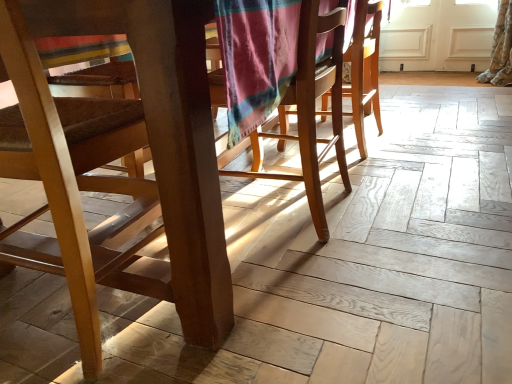
Question: Could you tell me if wooden chair at left, marked as the 1th chair in a left-to-right arrangement, is facing wooden chair at center, the 2th chair in the left-to-right sequence?

Choices:
 (A) no
 (B) yes

Answer: (A)

Question: Is the depth of wooden chair at left, which is the 2th chair in right-to-left order, greater than that of wooden chair at center, the 2th chair in the left-to-right sequence?

Choices:
 (A) yes
 (B) no

Answer: (B)

Question: Does wooden chair at left, which is the 2th chair in right-to-left order, appear on the right side of wooden chair at center, the 2th chair in the left-to-right sequence?

Choices:
 (A) yes
 (B) no

Answer: (B)

Question: From the image's perspective, is wooden chair at left, marked as the 1th chair in a left-to-right arrangement, below wooden chair at center, the 2th chair in the left-to-right sequence?

Choices:
 (A) no
 (B) yes

Answer: (B)

Question: Can you confirm if wooden chair at left, marked as the 1th chair in a left-to-right arrangement, is thinner than wooden chair at center, the 2th chair in the left-to-right sequence?

Choices:
 (A) no
 (B) yes

Answer: (A)

Question: Can you confirm if wooden chair at left, marked as the 1th chair in a left-to-right arrangement, is shorter than wooden chair at center, the 2th chair in the left-to-right sequence?

Choices:
 (A) no
 (B) yes

Answer: (A)

Question: From the image's perspective, does wooden chair at center, which is the 1th chair from right to left, appear higher than wooden chair at left, marked as the 1th chair in a left-to-right arrangement?

Choices:
 (A) yes
 (B) no

Answer: (A)

Question: Can you confirm if wooden chair at center, which is the 1th chair from right to left, is smaller than wooden chair at left, marked as the 1th chair in a left-to-right arrangement?

Choices:
 (A) yes
 (B) no

Answer: (A)

Question: Is wooden chair at center, which is the 1th chair from right to left, bigger than wooden chair at left, marked as the 1th chair in a left-to-right arrangement?

Choices:
 (A) no
 (B) yes

Answer: (A)

Question: Is wooden chair at center, the 2th chair in the left-to-right sequence, wider than wooden chair at left, which is the 2th chair in right-to-left order?

Choices:
 (A) no
 (B) yes

Answer: (A)

Question: Is wooden chair at center, which is the 1th chair from right to left, surrounding wooden chair at left, which is the 2th chair in right-to-left order?

Choices:
 (A) yes
 (B) no

Answer: (B)

Question: Does wooden chair at center, the 2th chair in the left-to-right sequence, turn towards wooden chair at left, marked as the 1th chair in a left-to-right arrangement?

Choices:
 (A) yes
 (B) no

Answer: (B)

Question: From their relative heights in the image, would you say wooden chair at left, which is the 2th chair in right-to-left order, is taller or shorter than wooden chair at center, the 2th chair in the left-to-right sequence?

Choices:
 (A) short
 (B) tall

Answer: (B)